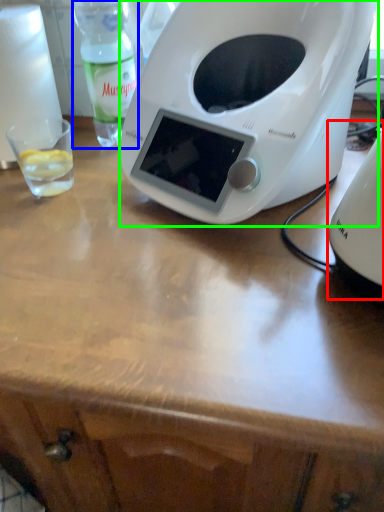
Question: Considering the real-world distances, which object is farthest from appliance (highlighted by a red box)? bottle (highlighted by a blue box) or toaster (highlighted by a green box)?

Choices:
 (A) bottle
 (B) toaster

Answer: (A)